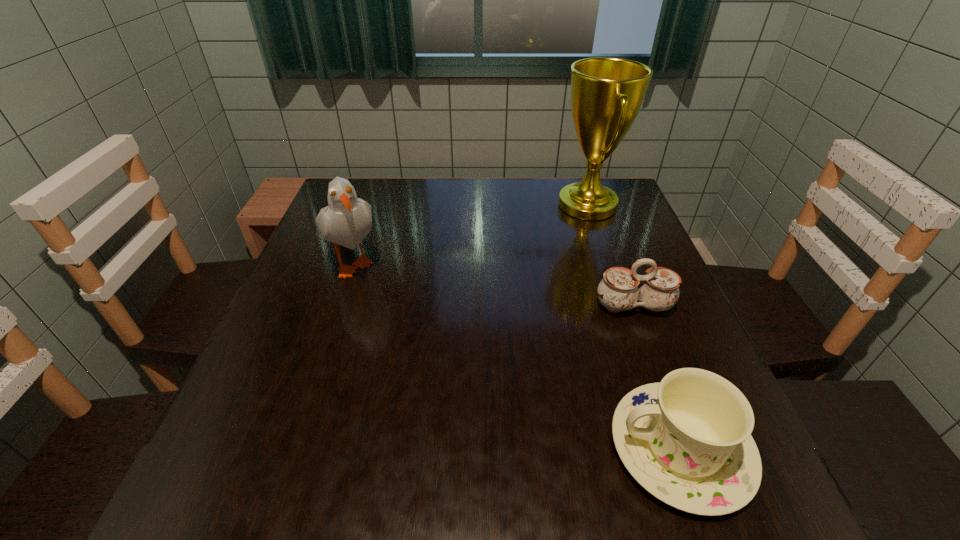
Find the location of `free space at the near edge`. free space at the near edge is located at coordinates (420, 483).

In the image, there is a desktop. At what (x,y) coordinates should I click in order to perform the action: click on vacant region at the left edge. Please return your answer as a coordinate pair (x, y). This screenshot has width=960, height=540. Looking at the image, I should click on (332, 244).

This screenshot has width=960, height=540. In order to click on vacant space at the far left corner of the desktop in this screenshot , I will do `click(372, 208)`.

Identify the location of free spot between the award and the farther chinaware. The height and width of the screenshot is (540, 960). (611, 255).

Identify the location of vacant point located between the tallest object and the nearer chinaware. The image size is (960, 540). (634, 327).

At what (x,y) coordinates should I click in order to perform the action: click on free area in between the nearer chinaware and the award. Please return your answer as a coordinate pair (x, y). Looking at the image, I should click on (634, 327).

In order to click on free spot between the tallest object and the leftmost object in this screenshot , I will do `click(470, 232)`.

Where is `empty space that is in between the tallest object and the farther chinaware`? empty space that is in between the tallest object and the farther chinaware is located at coordinates (611, 255).

This screenshot has height=540, width=960. I want to click on empty space that is in between the award and the farther chinaware, so click(611, 255).

Where is `empty space between the third shortest object and the award`? Image resolution: width=960 pixels, height=540 pixels. empty space between the third shortest object and the award is located at coordinates (x=470, y=232).